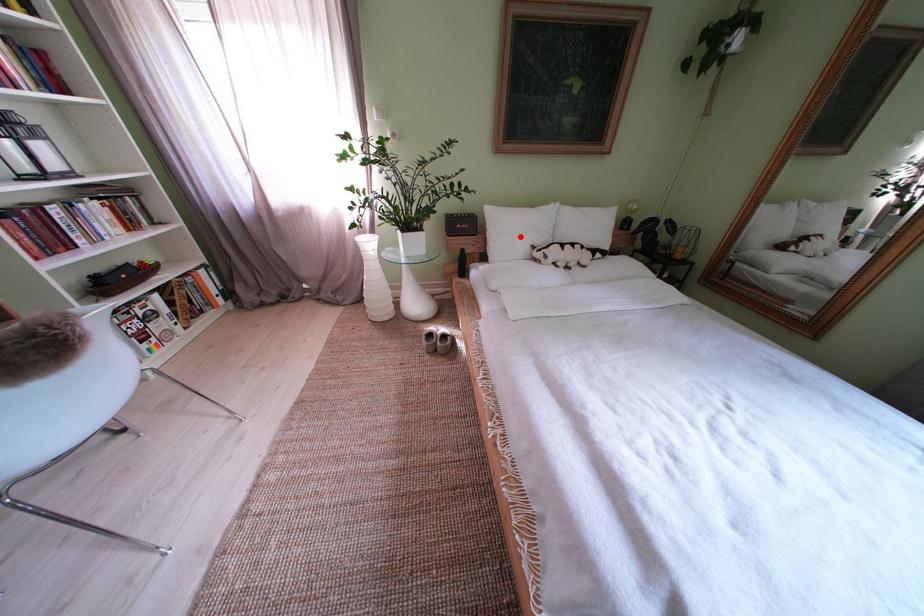
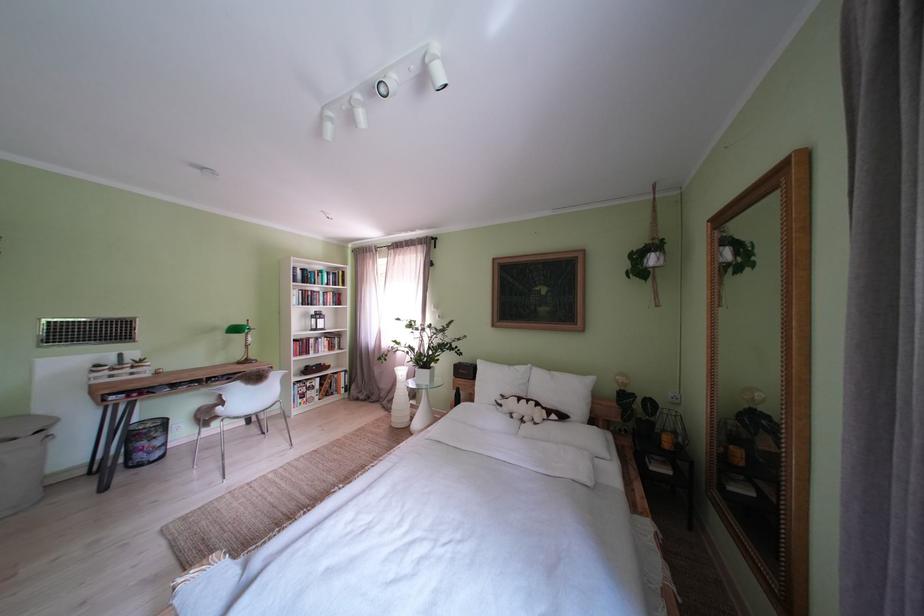
Question: I am providing you with two images of the same scene from different viewpoints. Given a red point in image1, look at the same physical point in image2. Is it:

Choices:
 (A) Closer to the viewpoint
 (B) Farther from the viewpoint

Answer: (B)